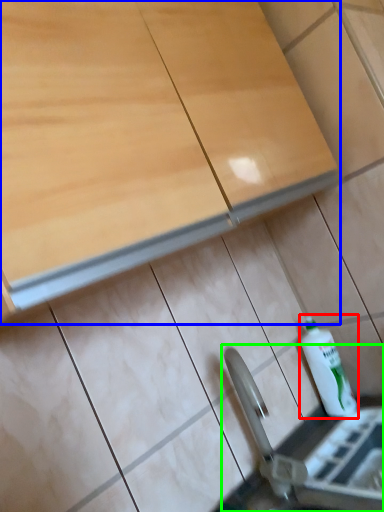
Question: Estimate the real-world distances between objects in this image. Which object is closer to bottle (highlighted by a red box), cabinetry (highlighted by a blue box) or sink (highlighted by a green box)?

Choices:
 (A) cabinetry
 (B) sink

Answer: (B)